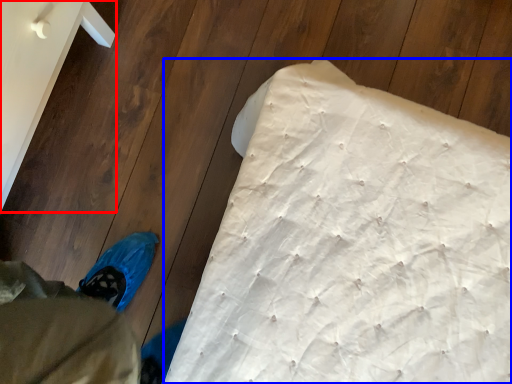
Question: Which object appears farthest to the camera in this image, furniture (highlighted by a red box) or mattress (highlighted by a blue box)?

Choices:
 (A) furniture
 (B) mattress

Answer: (B)